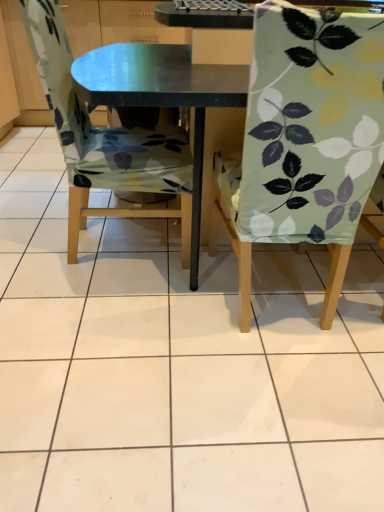
Question: Is light green fabric chair at right, the second chair in the left-to-right sequence, to the right of floral fabric chair at left, the first chair from the left, from the viewer's perspective?

Choices:
 (A) yes
 (B) no

Answer: (A)

Question: Is there a large distance between light green fabric chair at right, the 1th chair from the right, and floral fabric chair at left, which ranks as the second chair in right-to-left order?

Choices:
 (A) yes
 (B) no

Answer: (B)

Question: From the image's perspective, is light green fabric chair at right, the 1th chair from the right, above floral fabric chair at left, the first chair from the left?

Choices:
 (A) yes
 (B) no

Answer: (B)

Question: From a real-world perspective, is light green fabric chair at right, the 1th chair from the right, over floral fabric chair at left, which ranks as the second chair in right-to-left order?

Choices:
 (A) yes
 (B) no

Answer: (A)

Question: From a real-world perspective, is light green fabric chair at right, the 1th chair from the right, beneath floral fabric chair at left, which ranks as the second chair in right-to-left order?

Choices:
 (A) no
 (B) yes

Answer: (A)

Question: Is light green fabric chair at right, the 1th chair from the right, oriented towards floral fabric chair at left, which ranks as the second chair in right-to-left order?

Choices:
 (A) no
 (B) yes

Answer: (A)

Question: Are floral fabric chair at left, which ranks as the second chair in right-to-left order, and light green fabric chair at right, the 1th chair from the right, far apart?

Choices:
 (A) no
 (B) yes

Answer: (A)

Question: Does floral fabric chair at left, the first chair from the left, have a smaller size compared to light green fabric chair at right, the second chair in the left-to-right sequence?

Choices:
 (A) no
 (B) yes

Answer: (A)

Question: Considering the relative sizes of floral fabric chair at left, which ranks as the second chair in right-to-left order, and light green fabric chair at right, the second chair in the left-to-right sequence, in the image provided, is floral fabric chair at left, which ranks as the second chair in right-to-left order, wider than light green fabric chair at right, the second chair in the left-to-right sequence,?

Choices:
 (A) no
 (B) yes

Answer: (B)

Question: Can we say floral fabric chair at left, which ranks as the second chair in right-to-left order, lies outside light green fabric chair at right, the second chair in the left-to-right sequence?

Choices:
 (A) no
 (B) yes

Answer: (B)

Question: Is floral fabric chair at left, which ranks as the second chair in right-to-left order, bigger than light green fabric chair at right, the 1th chair from the right?

Choices:
 (A) yes
 (B) no

Answer: (A)

Question: Is floral fabric chair at left, the first chair from the left, taller than light green fabric chair at right, the second chair in the left-to-right sequence?

Choices:
 (A) yes
 (B) no

Answer: (B)

Question: Looking at their shapes, would you say light green fabric chair at right, the 1th chair from the right, is wider or thinner than floral fabric chair at left, the first chair from the left?

Choices:
 (A) thin
 (B) wide

Answer: (A)